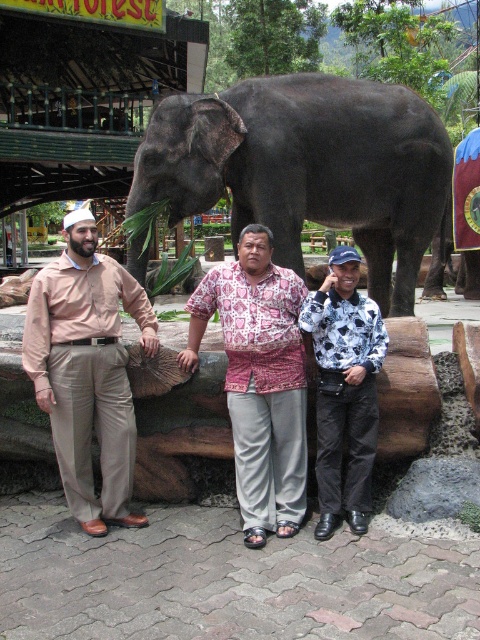
Can you confirm if matte beige pants at left is positioned below white printed shirt at center?

No.

Which is below, matte beige pants at left or white printed shirt at center?

white printed shirt at center is lower down.

Find the location of a particular element. Image resolution: width=480 pixels, height=640 pixels. matte beige pants at left is located at coordinates (86, 371).

Can you confirm if dark gray elephant at center is wider than matte beige pants at left?

Indeed, dark gray elephant at center has a greater width compared to matte beige pants at left.

What do you see at coordinates (307, 168) in the screenshot? I see `dark gray elephant at center` at bounding box center [307, 168].

Where is `dark gray elephant at center`? The height and width of the screenshot is (640, 480). dark gray elephant at center is located at coordinates (307, 168).

Who is taller, dark gray elephant at center or printed fabric shirt at center?

dark gray elephant at center

Which of these two, dark gray elephant at center or printed fabric shirt at center, stands shorter?

printed fabric shirt at center

At what (x,y) coordinates should I click in order to perform the action: click on dark gray elephant at center. Please return your answer as a coordinate pair (x, y). Looking at the image, I should click on (307, 168).